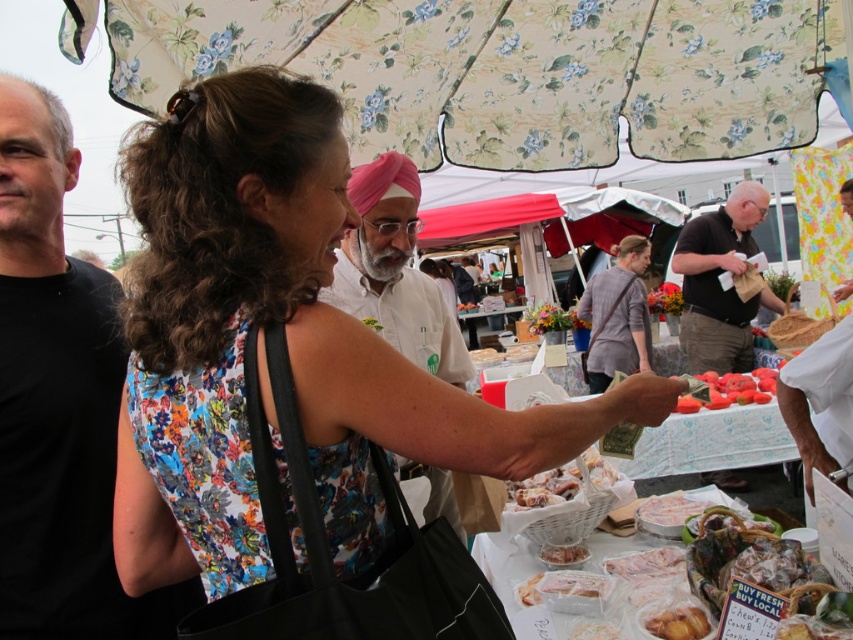
Question: Is floral fabric dress at center positioned at the back of dark brown leather wallet at center?

Choices:
 (A) no
 (B) yes

Answer: (A)

Question: Is black matte t-shirt at left above white frosted cake at center?

Choices:
 (A) yes
 (B) no

Answer: (A)

Question: Can you confirm if dark brown leather wallet at center is thinner than ripe red tomatoes at center?

Choices:
 (A) yes
 (B) no

Answer: (B)

Question: Estimate the real-world distances between objects in this image. Which object is closer to the pink fabric turban at center?

Choices:
 (A) gray cotton shirt at center
 (B) dark brown leather wallet at center
 (C) white frosted cake at center
 (D) white frosted pastries at center

Answer: (D)

Question: Which object is the farthest from the ripe red tomatoes at center?

Choices:
 (A) floral fabric dress at center
 (B) golden brown pastry at center
 (C) pink fabric turban at center

Answer: (A)

Question: Which object appears closest to the camera in this image?

Choices:
 (A) white frosted pastries at center
 (B) golden brown pastry at center
 (C) black matte t-shirt at left
 (D) gray cotton shirt at center

Answer: (B)